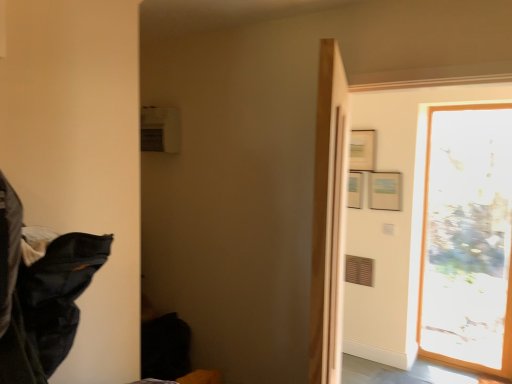
In order to click on transparent glass door at right in this screenshot , I will do `click(468, 239)`.

Describe the element at coordinates (468, 239) in the screenshot. The image size is (512, 384). I see `transparent glass door at right` at that location.

This screenshot has height=384, width=512. Find the location of `black fabric at left`. black fabric at left is located at coordinates (14, 299).

Describe the element at coordinates (14, 299) in the screenshot. The width and height of the screenshot is (512, 384). I see `black fabric at left` at that location.

In order to face black fabric at left, should I rotate leftwards or rightwards?

Rotate left and turn 29.766 degrees.

This screenshot has height=384, width=512. Identify the location of transparent glass door at right. (468, 239).

Considering the relative positions of black fabric at left and transparent glass door at right in the image provided, is black fabric at left to the left or to the right of transparent glass door at right?

Clearly, black fabric at left is on the left of transparent glass door at right in the image.

Is black fabric at left closer to the viewer compared to transparent glass door at right?

Yes, the depth of black fabric at left is less than that of transparent glass door at right.

Considering the points (10, 198) and (428, 209), which point is behind, point (10, 198) or point (428, 209)?

The point (428, 209) is more distant.

From the image's perspective, between black fabric at left and transparent glass door at right, which one is located above?

black fabric at left.

From a real-world perspective, does black fabric at left sit lower than transparent glass door at right?

No, from a real-world perspective, black fabric at left is not below transparent glass door at right.

Between black fabric at left and transparent glass door at right, which one has larger width?

Wider between the two is black fabric at left.

Considering the relative sizes of black fabric at left and transparent glass door at right in the image provided, is black fabric at left taller than transparent glass door at right?

In fact, black fabric at left may be shorter than transparent glass door at right.

Considering the sizes of objects black fabric at left and transparent glass door at right in the image provided, who is bigger, black fabric at left or transparent glass door at right?

transparent glass door at right is bigger.

Looking at this image, would you say black fabric at left is outside transparent glass door at right?

That's correct, black fabric at left is outside of transparent glass door at right.

Looking at this image, is black fabric at left next to transparent glass door at right?

There is a gap between black fabric at left and transparent glass door at right.

Is black fabric at left facing away from transparent glass door at right?

No, transparent glass door at right is not at the back of black fabric at left.

How much distance is there between black fabric at left and transparent glass door at right?

The distance of black fabric at left from transparent glass door at right is 10.23 feet.

The width and height of the screenshot is (512, 384). In order to click on laundry in front of the transparent glass door at right in this screenshot , I will do `click(14, 299)`.

Which object is positioned more to the right, transparent glass door at right or black fabric at left?

Positioned to the right is transparent glass door at right.

Considering the relative positions of transparent glass door at right and black fabric at left in the image provided, is transparent glass door at right in front of black fabric at left?

No, it is not.

Does point (510, 354) come in front of point (13, 290)?

No.

From the image's perspective, which one is positioned higher, transparent glass door at right or black fabric at left?

black fabric at left.

From a real-world perspective, which is physically above, transparent glass door at right or black fabric at left?

From a 3D spatial view, black fabric at left is above.

In the scene shown: Considering the sizes of objects transparent glass door at right and black fabric at left in the image provided, who is thinner, transparent glass door at right or black fabric at left?

transparent glass door at right is thinner.

Considering the relative sizes of transparent glass door at right and black fabric at left in the image provided, is transparent glass door at right taller than black fabric at left?

Yes, transparent glass door at right is taller than black fabric at left.

Based on their sizes in the image, would you say transparent glass door at right is bigger or smaller than black fabric at left?

Considering their sizes, transparent glass door at right takes up more space than black fabric at left.

Is transparent glass door at right situated inside black fabric at left or outside?

transparent glass door at right cannot be found inside black fabric at left.

Are transparent glass door at right and black fabric at left making contact?

No, transparent glass door at right is not making contact with black fabric at left.

Is transparent glass door at right facing towards black fabric at left?

Yes, transparent glass door at right is aimed at black fabric at left.

What's the angular difference between transparent glass door at right and black fabric at left's facing directions?

transparent glass door at right and black fabric at left are facing 87.8 degrees away from each other.

Find the location of a particular element. The width and height of the screenshot is (512, 384). window that is behind the black fabric at left is located at coordinates (468, 239).

I want to click on window on the right of black fabric at left, so click(x=468, y=239).

Where is `laundry above the transparent glass door at right (from the image's perspective)`? laundry above the transparent glass door at right (from the image's perspective) is located at coordinates (14, 299).